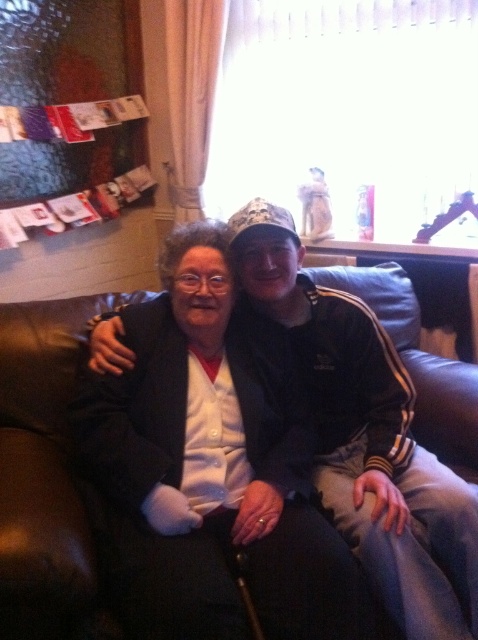
You are a delivery person arriving at this living room and need to place a small package between the black adidas tracksuit at center and the brown leather couch at center. Can you fit the package between them?

The brown leather couch at center is behind the black adidas tracksuit at center, so there is no space between them for the package to be placed.

You are a delivery person who needs to place a small package between the black adidas tracksuit at center and the brown leather couch at center. Is there enough space to fit the package?

The distance between the black adidas tracksuit at center and the brown leather couch at center is 25.32 inches. Since the package is small, it should fit comfortably in the available space.

You are a photographer setting up a shoot in the living room. You need to position a large lamp that is 1.5 meters tall so it doesn not block the view of the black adidas tracksuit at center and the brown leather couch at center. Where should you place the lamp relative to these objects?

The black adidas tracksuit at center is located above the brown leather couch at center. To avoid blocking their view, the lamp should be placed behind the brown leather couch at center so it doesn not interfere with the foreground objects.